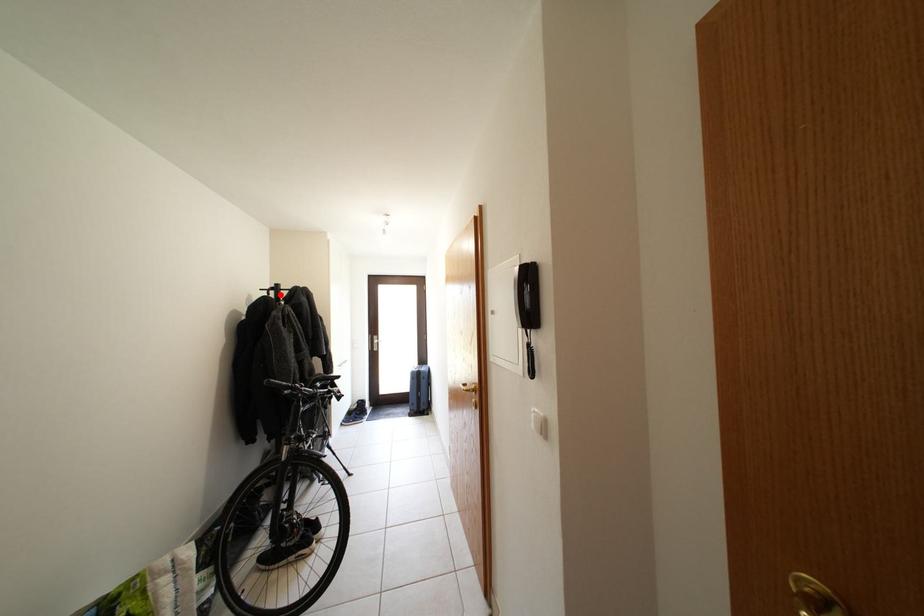
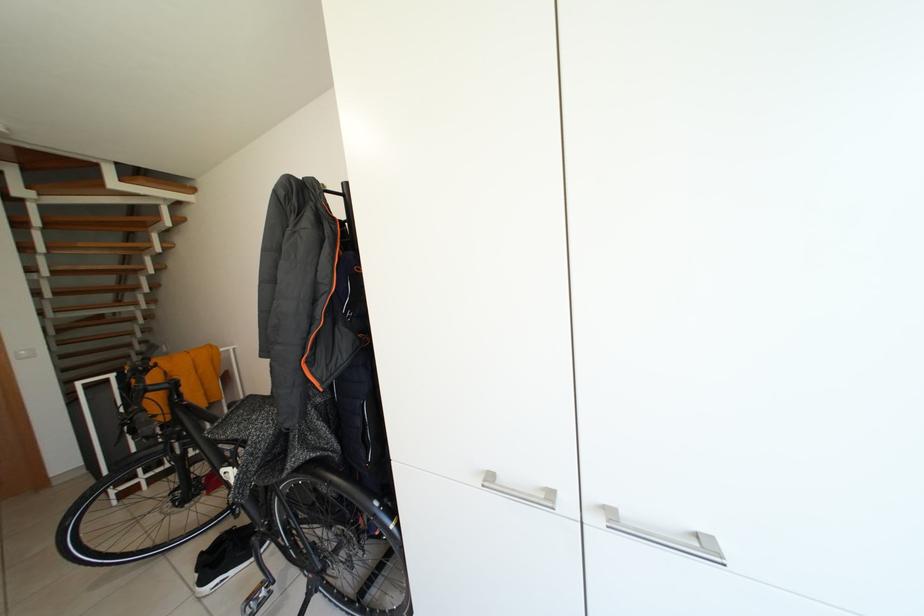
Question: I am providing you with two images of the same scene from different viewpoints. A red point is marked on the first image. Can you still see the location of the red point in image 2?

Choices:
 (A) Yes
 (B) No

Answer: (B)